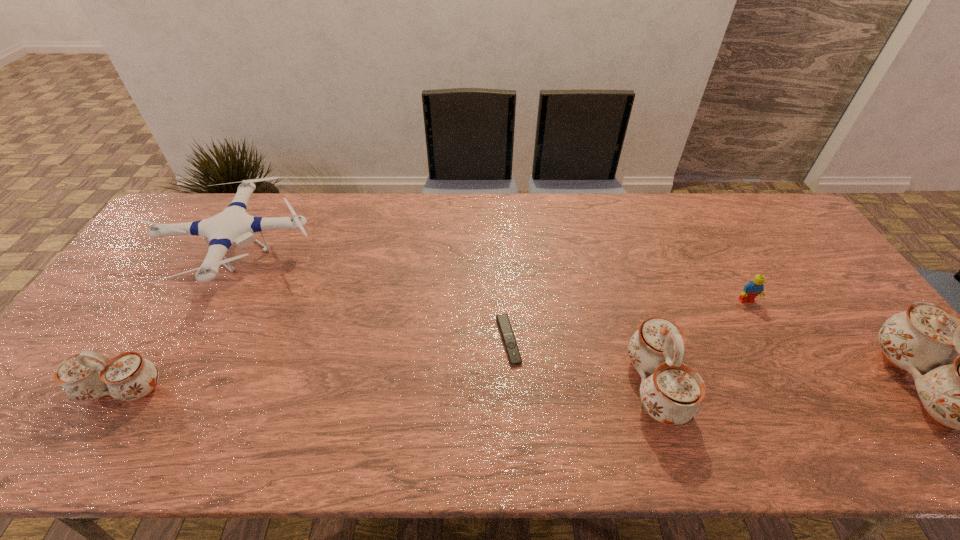
This screenshot has height=540, width=960. I want to click on vacant space at the right edge of the desktop, so click(x=782, y=282).

This screenshot has height=540, width=960. In the image, there is a desktop. Find the location of `free space at the far right corner`. free space at the far right corner is located at coordinates (738, 204).

Locate an element on the screen. This screenshot has width=960, height=540. free spot between the fourth object from right to left and the drone is located at coordinates (372, 299).

You are a GUI agent. You are given a task and a screenshot of the screen. Output one action in this format:
    pyautogui.click(x=<x>, y=<y>)
    Task: Click on the vacant point located between the second shortest chinaware and the Lego
    The width and height of the screenshot is (960, 540).
    Given the screenshot: What is the action you would take?
    pyautogui.click(x=701, y=344)

Identify the location of vacant space that is in between the fourth object from left to right and the fourth object from right to left. This screenshot has width=960, height=540. (582, 363).

Locate an element on the screen. The width and height of the screenshot is (960, 540). vacant space in between the second shortest object and the shortest chinaware is located at coordinates (435, 345).

This screenshot has height=540, width=960. Find the location of `free space between the second chinaware from left to right and the drone`. free space between the second chinaware from left to right and the drone is located at coordinates (444, 322).

You are a GUI agent. You are given a task and a screenshot of the screen. Output one action in this format:
    pyautogui.click(x=<x>, y=<y>)
    Task: Click on the empty space between the shortest chinaware and the fourth object from right to left
    
    Given the screenshot: What is the action you would take?
    pyautogui.click(x=316, y=365)

Find the location of `vacant space in between the remote control and the drone`. vacant space in between the remote control and the drone is located at coordinates (372, 299).

This screenshot has height=540, width=960. In order to click on unoccupied position between the second object from right to left and the third object from right to left in this screenshot , I will do `click(701, 344)`.